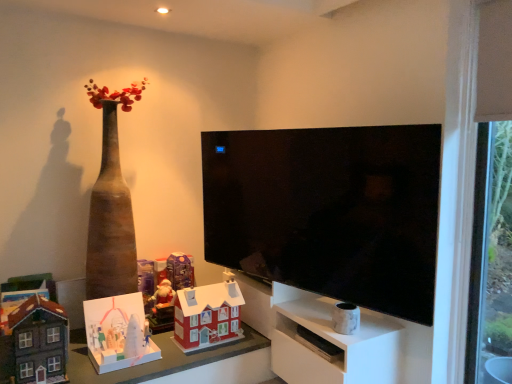
Question: From their relative heights in the image, would you say matte cardboard table at lower center is taller or shorter than transparent glass door at right?

Choices:
 (A) short
 (B) tall

Answer: (A)

Question: Looking at their shapes, would you say matte cardboard table at lower center is wider or thinner than transparent glass door at right?

Choices:
 (A) wide
 (B) thin

Answer: (A)

Question: Considering the real-world distances, which object is closest to the white marble vase at lower right, placed as the fifth toy when sorted from left to right?

Choices:
 (A) white marble vase at lower center
 (B) matte cardboard table at lower center
 (C) black glossy tv at center
 (D) transparent glass door at right
 (E) matte red plastic house at lower center, positioned as the 4th toy in left-to-right order

Answer: (A)

Question: Estimate the real-world distances between objects in this image. Which object is farther from the matte cardboard table at lower center?

Choices:
 (A) transparent glass door at right
 (B) white cardboard house at lower left, which is the second toy in left-to-right order
 (C) matte purple toy at center, the 3th toy positioned from the left
 (D) matte red plastic house at lower center, marked as the second toy in a right-to-left arrangement
 (E) white marble vase at lower center

Answer: (A)